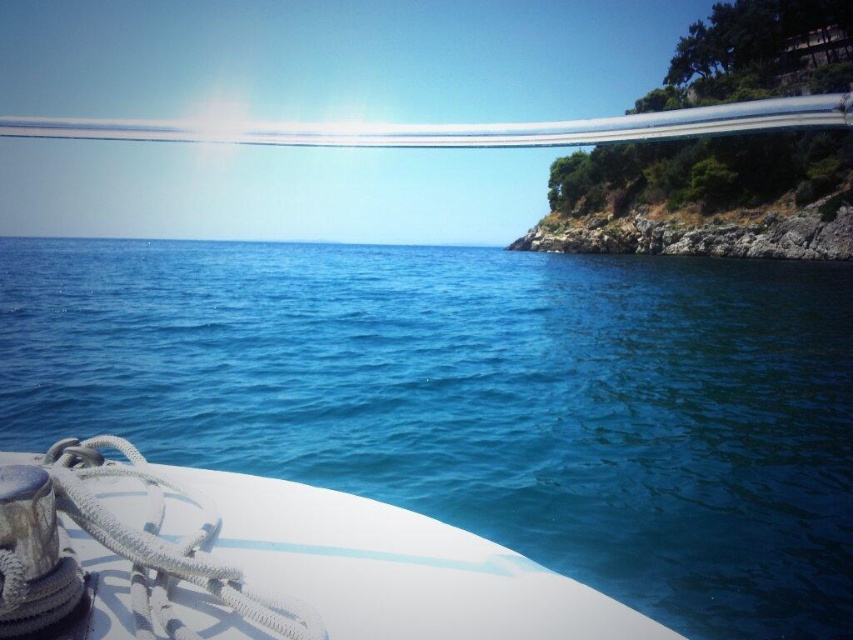
You are standing on the deck of the boat and want to throw a small floating toy into the water. The toy requires at least 5 meters of open water to float properly. Based on the scene, will the blue liquid water at center provide enough space for the toy to float?

The blue liquid water at center is 7.78 meters from the viewer, which means there is sufficient open water for the toy to float as it exceeds the required 5 meters.

You are standing on the deck of the boat and looking out at the scene. Which object, the blue liquid water at center or the white matte boat at lower left, appears taller from your perspective?

The blue liquid water at center appears taller than the white matte boat at lower left from your perspective.